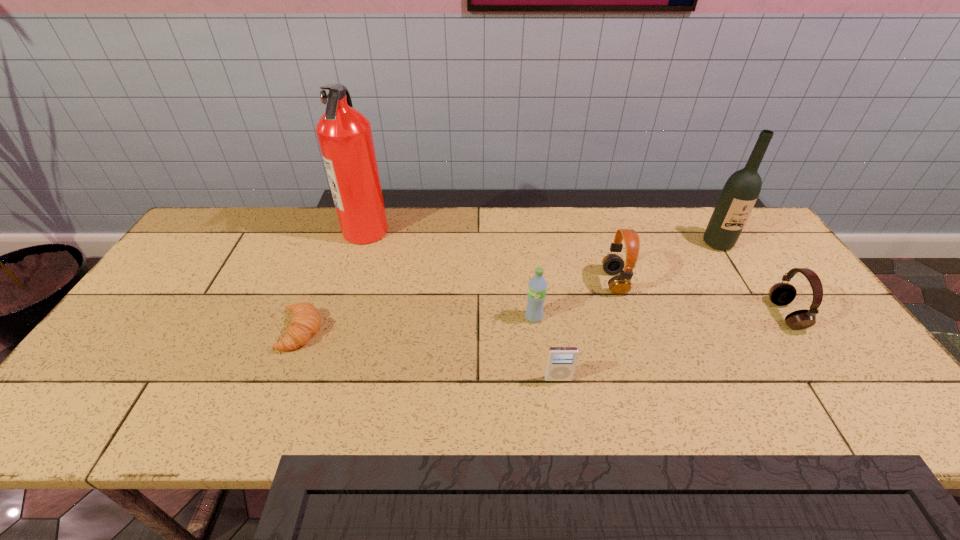
Find the location of `fire extinguisher`. fire extinguisher is located at coordinates (344, 134).

Locate an element on the screen. The height and width of the screenshot is (540, 960). the second tallest object is located at coordinates (740, 193).

Where is `the taller headset`? The image size is (960, 540). the taller headset is located at coordinates (613, 264).

The height and width of the screenshot is (540, 960). What are the coordinates of `the left headset` in the screenshot? It's located at (613, 264).

You are a GUI agent. You are given a task and a screenshot of the screen. Output one action in this format:
    pyautogui.click(x=<x>, y=<y>)
    Task: Click on the water bottle
    The height and width of the screenshot is (540, 960).
    Given the screenshot: What is the action you would take?
    pyautogui.click(x=537, y=286)

Identify the location of the third shortest object. (781, 294).

Find the location of a particular element. Image resolution: width=960 pixels, height=540 pixels. the shorter headset is located at coordinates (781, 294).

Find the location of a particular element. The height and width of the screenshot is (540, 960). the nearest object is located at coordinates (561, 362).

Find the location of `the second shortest object`. the second shortest object is located at coordinates (561, 362).

Where is `the shortest object`? The width and height of the screenshot is (960, 540). the shortest object is located at coordinates pyautogui.click(x=305, y=322).